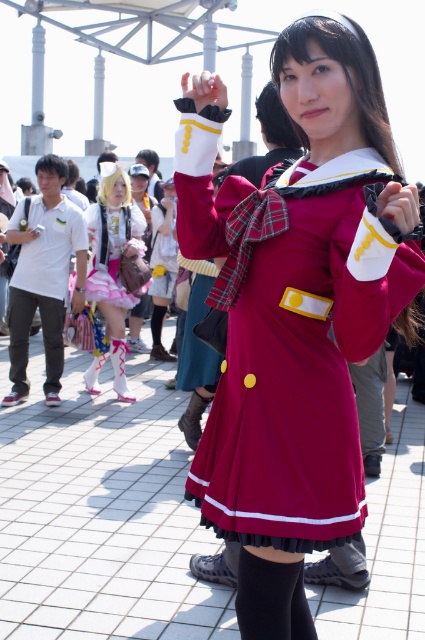
From the picture: Who is taller, pastel chiffon dress at center or black cotton pants at left?

pastel chiffon dress at center is taller.

You are a GUI agent. You are given a task and a screenshot of the screen. Output one action in this format:
    pyautogui.click(x=<x>, y=<y>)
    Task: Click on the pastel chiffon dress at center
    This screenshot has height=640, width=425.
    Given the screenshot: What is the action you would take?
    pyautogui.click(x=113, y=269)

Is matte red dress at center wider than black cotton pants at left?

Yes, matte red dress at center is wider than black cotton pants at left.

Can you confirm if matte red dress at center is positioned below black cotton pants at left?

Incorrect, matte red dress at center is not positioned below black cotton pants at left.

Is point (350, 396) farther from camera compared to point (57, 340)?

No, (350, 396) is closer to viewer.

At what (x,y) coordinates should I click in order to perform the action: click on matte red dress at center. Please return your answer as a coordinate pair (x, y). Looking at the image, I should click on (294, 310).

Can you confirm if pastel chiffon dress at center is bigger than pastel pink satin dress at center?

Indeed, pastel chiffon dress at center has a larger size compared to pastel pink satin dress at center.

Is pastel chiffon dress at center smaller than pastel pink satin dress at center?

Incorrect, pastel chiffon dress at center is not smaller in size than pastel pink satin dress at center.

Which is in front, point (91, 371) or point (124, 209)?

Point (124, 209)

This screenshot has height=640, width=425. Find the location of `pastel chiffon dress at center`. pastel chiffon dress at center is located at coordinates (113, 269).